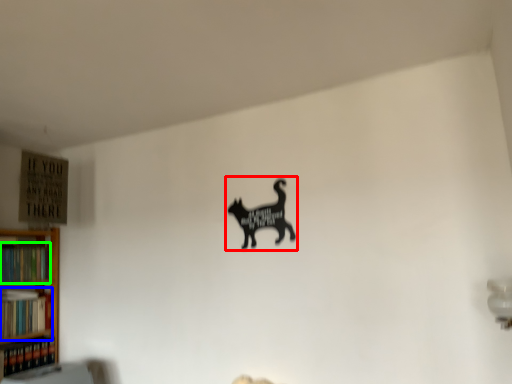
Question: Based on their relative distances, which object is farther from animal (highlighted by a red box)? Choose from book (highlighted by a blue box) and book (highlighted by a green box).

Choices:
 (A) book
 (B) book

Answer: (A)